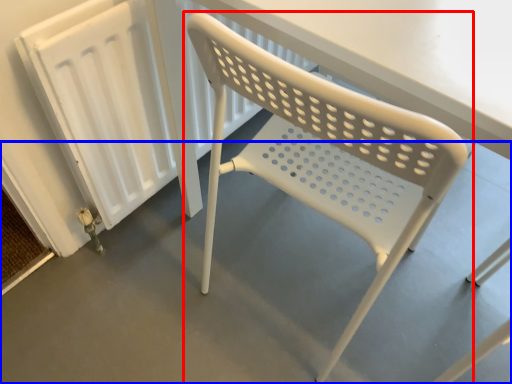
Question: Among these objects, which one is farthest to the camera, chair (highlighted by a red box) or concrete (highlighted by a blue box)?

Choices:
 (A) chair
 (B) concrete

Answer: (B)